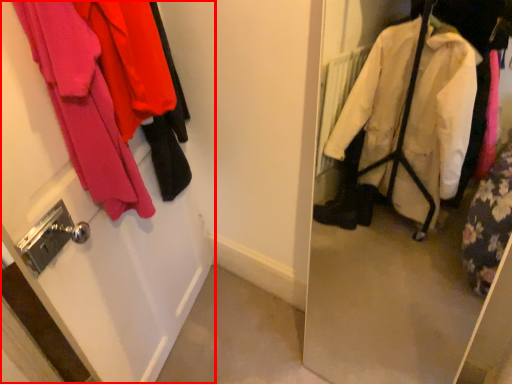
Question: Where is door (annotated by the red box) located in relation to closet in the image?

Choices:
 (A) right
 (B) left

Answer: (B)